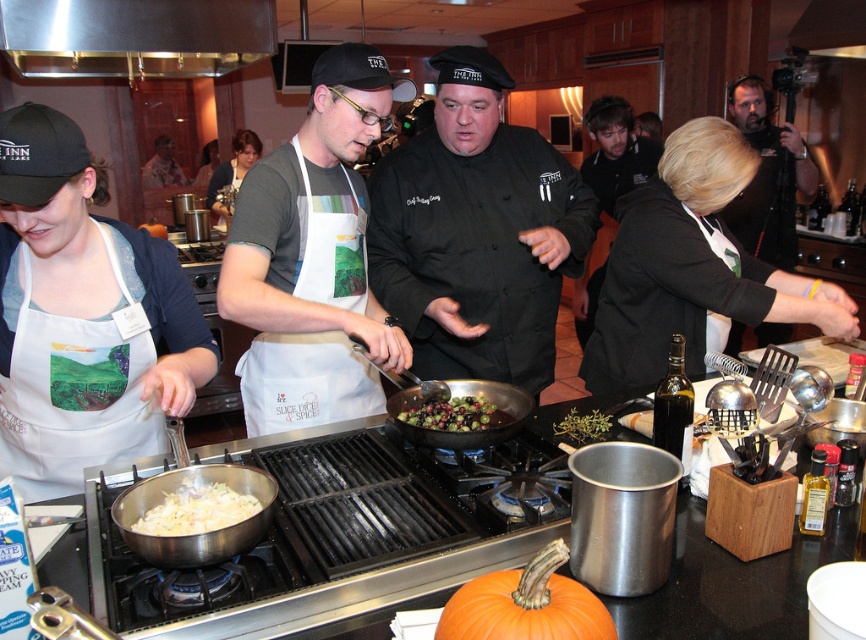
You are standing in the kitchen and need to reach the black matte jacket at center. What are the coordinates of the jacket?

The coordinates of the black matte jacket at center are at point (616,150).

You are a guest at the cooking demonstration and want to find the white cotton apron at center. What are the coordinates where you should look?

The white cotton apron at center is located at coordinates point (x=304, y=381).